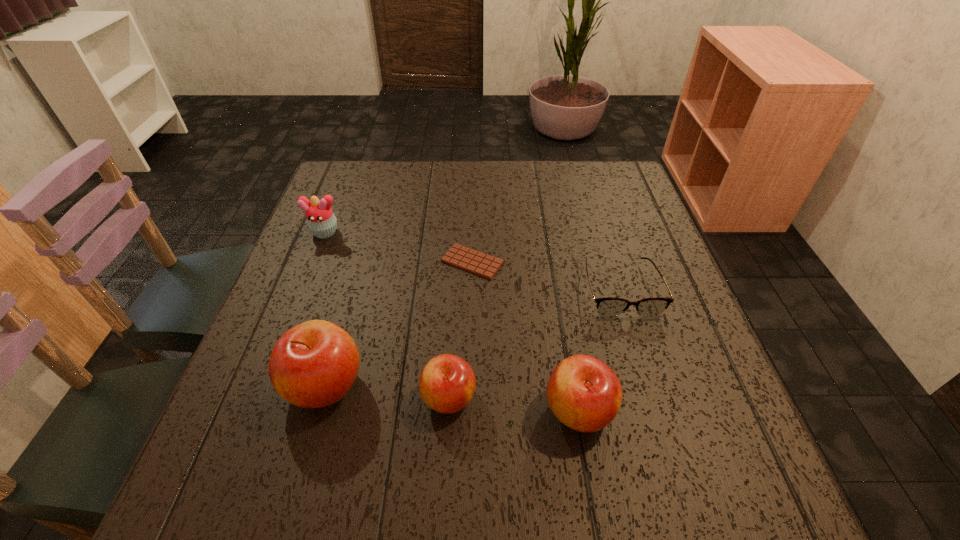
Locate an element on the screen. This screenshot has width=960, height=540. vacant area that lies between the tallest object and the farthest object is located at coordinates (324, 309).

At what (x,y) coordinates should I click in order to perform the action: click on empty space that is in between the cupcake and the candy bar. Please return your answer as a coordinate pair (x, y). Looking at the image, I should click on (398, 247).

Locate an element on the screen. vacant space that is in between the shortest object and the second apple from left to right is located at coordinates (461, 330).

Locate an element on the screen. This screenshot has width=960, height=540. vacant area that lies between the fourth tallest object and the tallest object is located at coordinates (387, 392).

You are a GUI agent. You are given a task and a screenshot of the screen. Output one action in this format:
    pyautogui.click(x=<x>, y=<y>)
    Task: Click on the object that can be found as the closest to the farthest object
    This screenshot has width=960, height=540.
    Given the screenshot: What is the action you would take?
    pyautogui.click(x=478, y=263)

Select which object is the third closest to the second apple from left to right. Please provide its 2D coordinates. Your answer should be formatted as a tuple, i.e. [(x, y)], where the tuple contains the x and y coordinates of a point satisfying the conditions above.

[(478, 263)]

Identify the location of the second closest apple to the rightmost apple. The height and width of the screenshot is (540, 960). (314, 364).

You are a GUI agent. You are given a task and a screenshot of the screen. Output one action in this format:
    pyautogui.click(x=<x>, y=<y>)
    Task: Click on the apple that is the third closest to the shortest object
    
    Given the screenshot: What is the action you would take?
    pyautogui.click(x=584, y=393)

The height and width of the screenshot is (540, 960). Identify the location of free point that satisfies the following two spatial constraints: 1. on the face of the candy bar; 2. on the left side of the cupcake. (313, 262).

At what (x,y) coordinates should I click in order to perform the action: click on free space that satisfies the following two spatial constraints: 1. on the face of the cupcake; 2. on the left side of the shortest object. Please return your answer as a coordinate pair (x, y). Looking at the image, I should click on (313, 262).